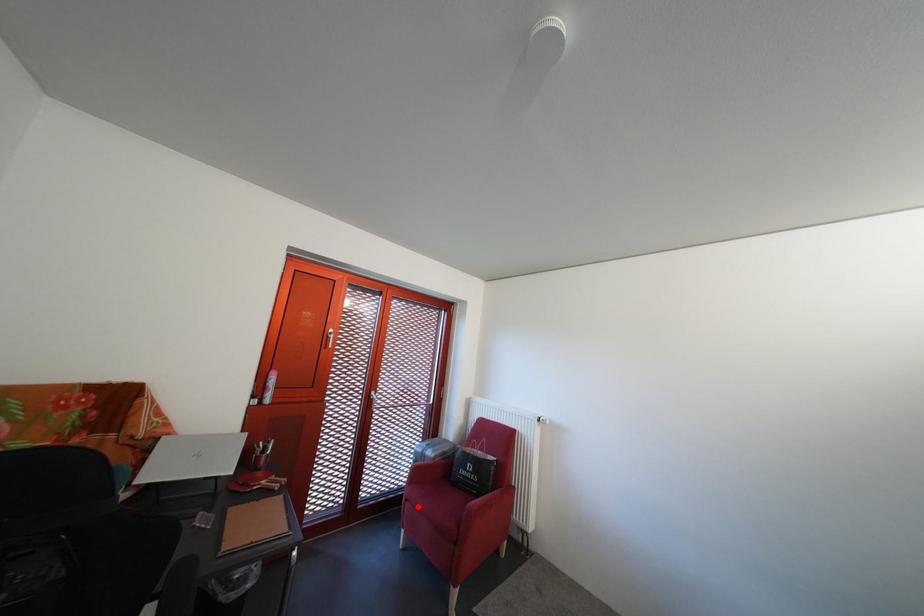
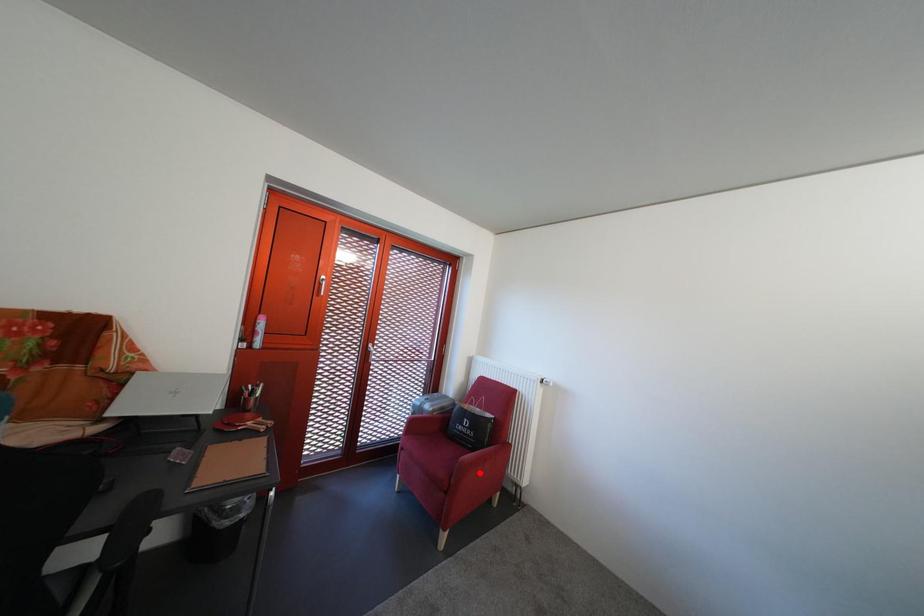
I am providing you with two images of the same scene from different viewpoints. A red point is marked on the first image and another point is marked on the second image. Do the highlighted points in image1 and image2 indicate the same real-world spot?

No